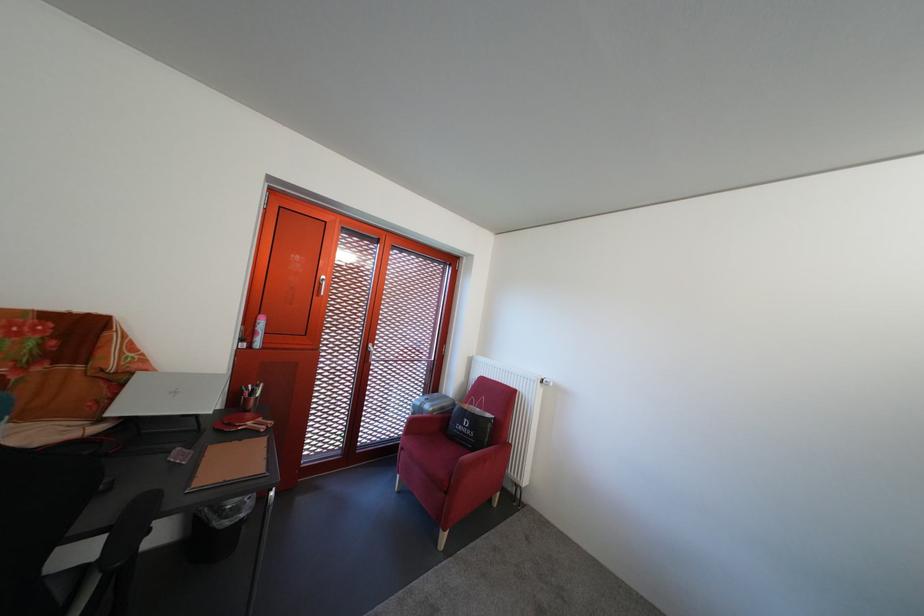
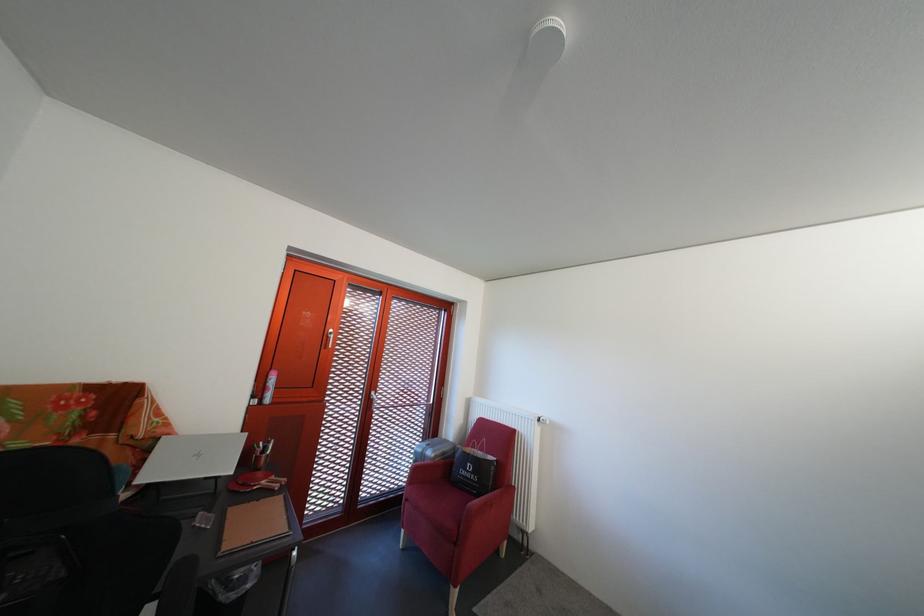
The point at (x=412, y=456) is marked in the first image. Where is the corresponding point in the second image?

(418, 507)